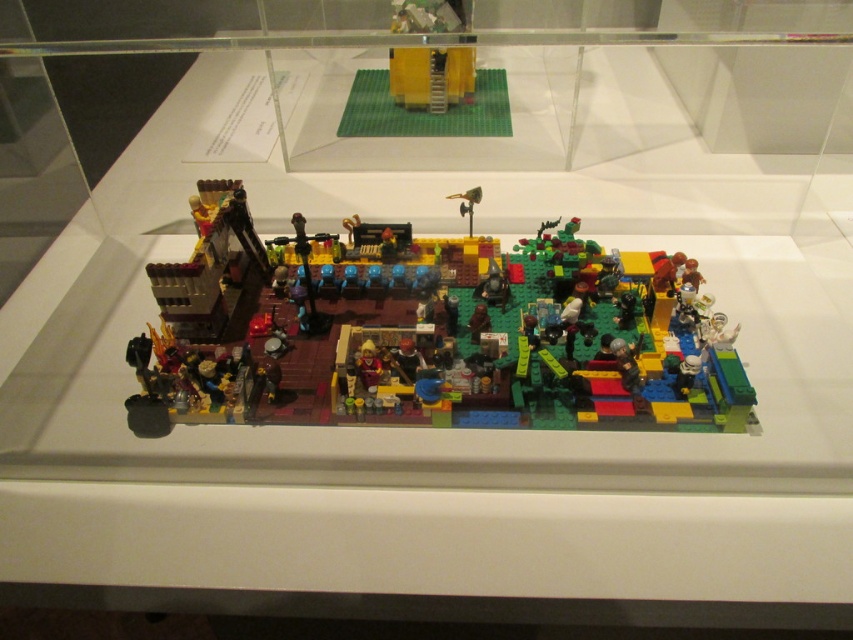
Question: Observing the image, what is the correct spatial positioning of multicolored plastic lego set at center in reference to yellow matte building at upper center?

Choices:
 (A) below
 (B) above

Answer: (A)

Question: Which point appears closest to the camera in this image?

Choices:
 (A) (402, 52)
 (B) (512, 310)

Answer: (B)

Question: Which object is closer to the camera taking this photo?

Choices:
 (A) yellow matte building at upper center
 (B) multicolored plastic lego set at center

Answer: (B)

Question: Does multicolored plastic lego set at center have a lesser width compared to yellow matte building at upper center?

Choices:
 (A) yes
 (B) no

Answer: (B)

Question: Among these objects, which one is nearest to the camera?

Choices:
 (A) yellow matte building at upper center
 (B) multicolored plastic lego set at center

Answer: (B)

Question: Does multicolored plastic lego set at center have a smaller size compared to yellow matte building at upper center?

Choices:
 (A) no
 (B) yes

Answer: (A)